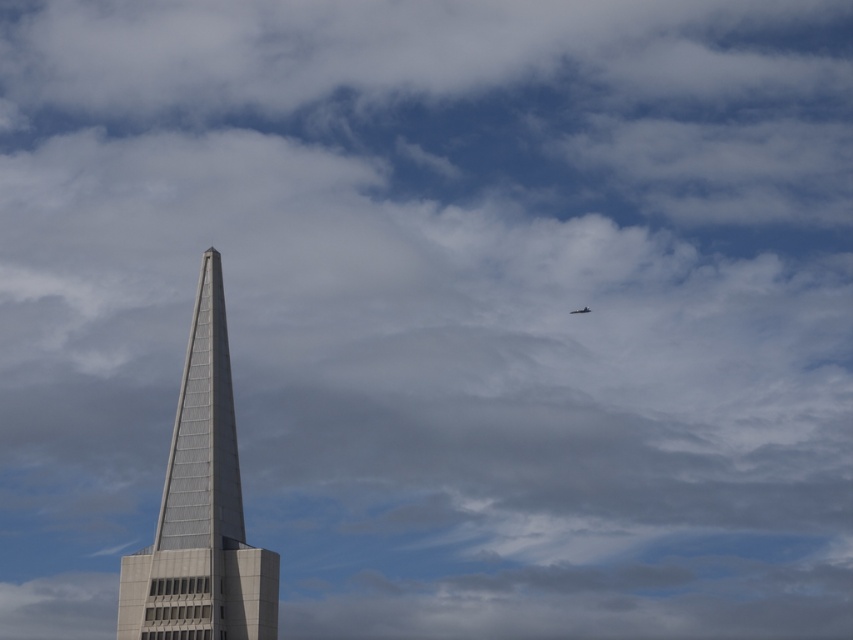
Is gray glass skyscraper at center thinner than shiny silver airplane at upper right?

In fact, gray glass skyscraper at center might be wider than shiny silver airplane at upper right.

Can you confirm if gray glass skyscraper at center is positioned above shiny silver airplane at upper right?

No, gray glass skyscraper at center is not above shiny silver airplane at upper right.

Locate an element on the screen. The image size is (853, 640). gray glass skyscraper at center is located at coordinates (201, 508).

Find the location of a particular element. The width and height of the screenshot is (853, 640). gray glass skyscraper at center is located at coordinates (201, 508).